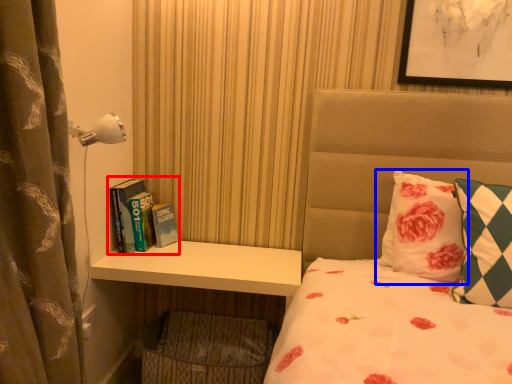
Question: Which of the following is the farthest to the observer, book (highlighted by a red box) or pillow (highlighted by a blue box)?

Choices:
 (A) book
 (B) pillow

Answer: (A)